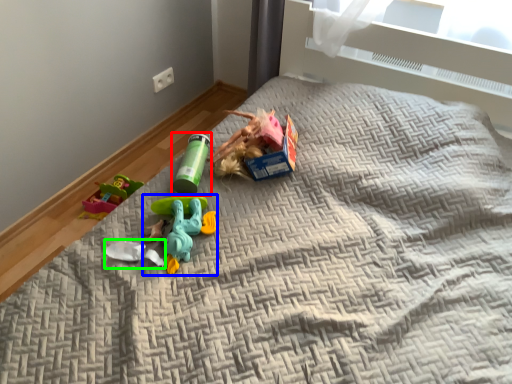
Question: Considering the real-world distances, which object is farthest from toy (highlighted by a red box)? toy (highlighted by a blue box) or toy (highlighted by a green box)?

Choices:
 (A) toy
 (B) toy

Answer: (B)